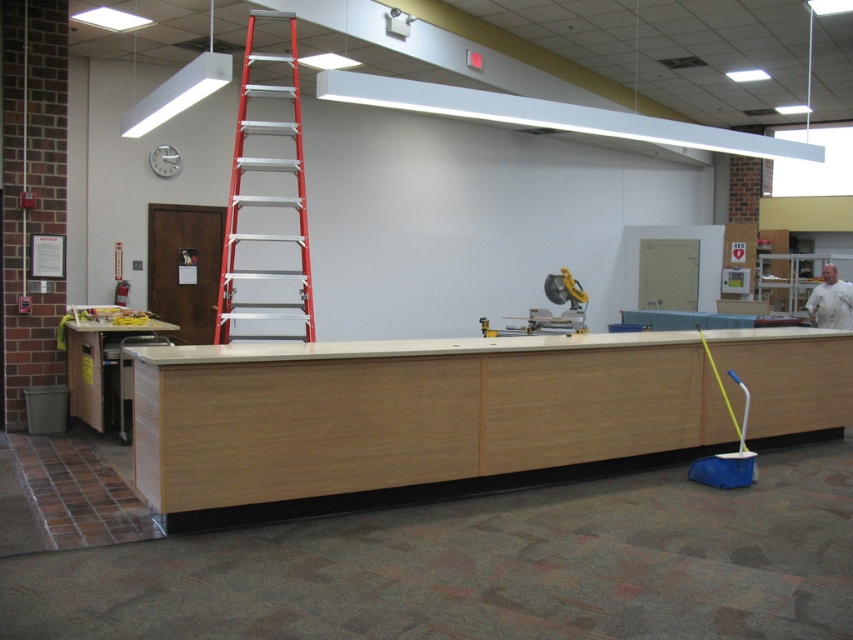
You are standing in the workspace shown in the image. There is a point marked at coordinates (x=407, y=420). What object is located at that point?

The point at coordinates (x=407, y=420) marks the location of the light wood counter at center.

You are organizing a tool storage area in this workspace. You have a large red aluminum ladder at upper center and a wooden cabinet at lower left. Which object requires more space to store?

The red aluminum ladder at upper center requires more space to store because it is bigger than the wooden cabinet at lower left.